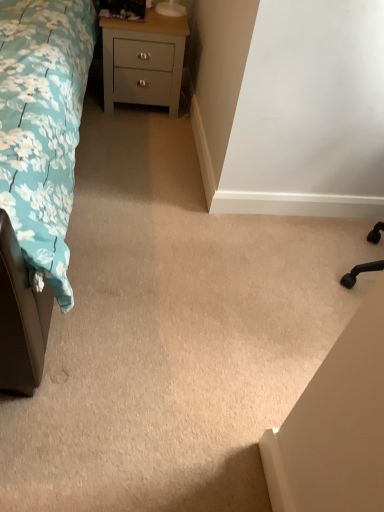
Question: From the image's perspective, is light gray painted wood chest of drawers at upper left positioned above or below teal floral fabric bed at left?

Choices:
 (A) below
 (B) above

Answer: (B)

Question: Do you think light gray painted wood chest of drawers at upper left is within teal floral fabric bed at left, or outside of it?

Choices:
 (A) inside
 (B) outside

Answer: (B)

Question: Does point (163, 42) appear closer or farther from the camera than point (62, 178)?

Choices:
 (A) closer
 (B) farther

Answer: (B)

Question: Do you think teal floral fabric bed at left is within light gray painted wood chest of drawers at upper left, or outside of it?

Choices:
 (A) inside
 (B) outside

Answer: (B)

Question: Is teal floral fabric bed at left wider or thinner than light gray painted wood chest of drawers at upper left?

Choices:
 (A) thin
 (B) wide

Answer: (B)

Question: Is point (64, 230) closer or farther from the camera than point (163, 84)?

Choices:
 (A) closer
 (B) farther

Answer: (A)

Question: Is teal floral fabric bed at left taller or shorter than light gray painted wood chest of drawers at upper left?

Choices:
 (A) tall
 (B) short

Answer: (A)